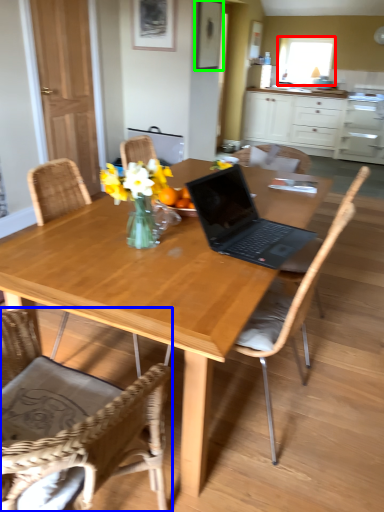
Question: Which is farther away from window screen (highlighted by a red box)? chair (highlighted by a blue box) or picture frame (highlighted by a green box)?

Choices:
 (A) chair
 (B) picture frame

Answer: (A)